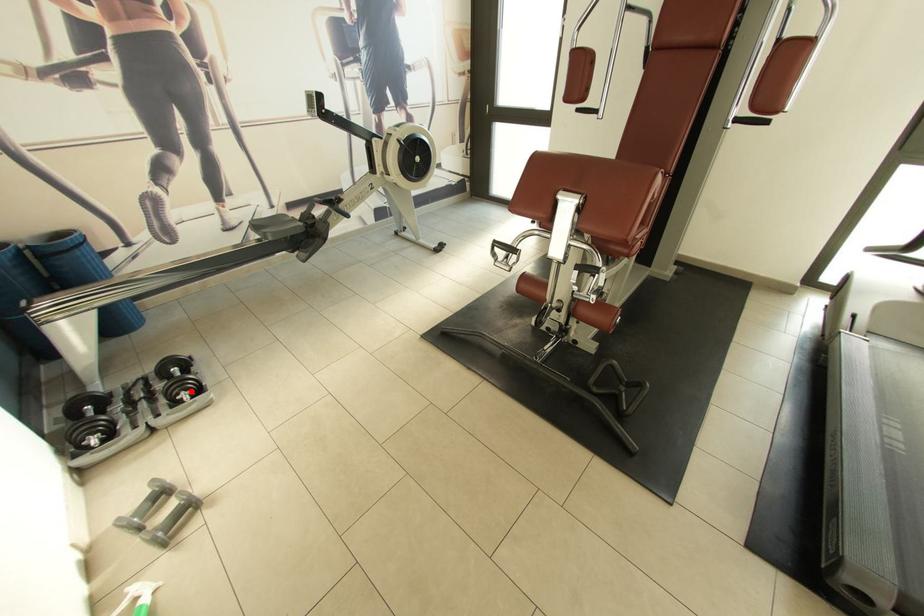
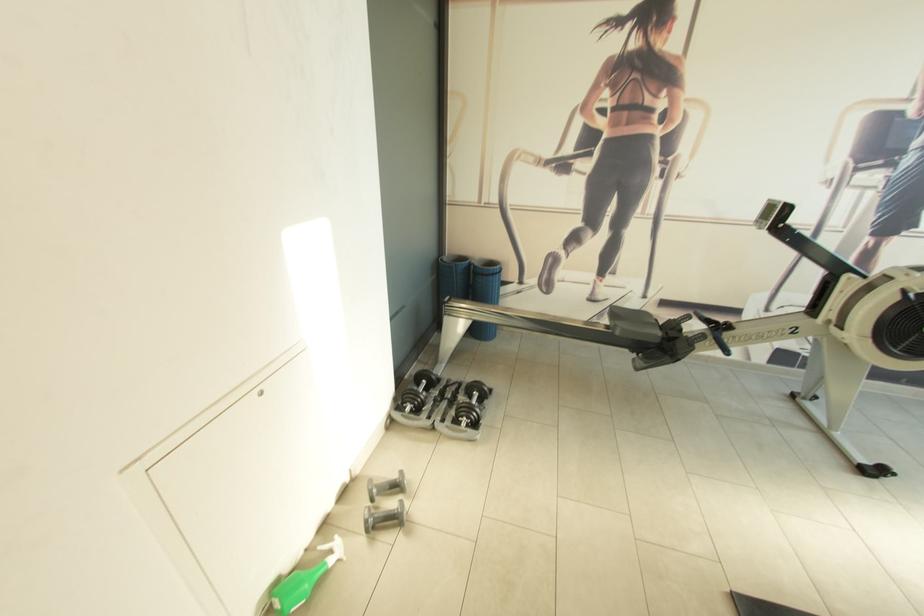
Find the pixel in the second image that matches the highlighted location in the first image.

(472, 419)